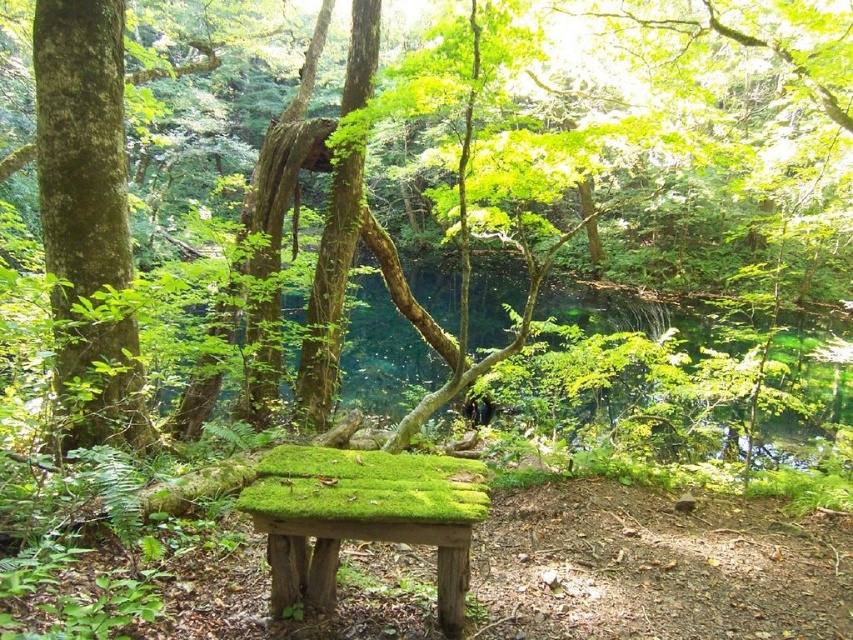
You are a hiker who wants to sit on the bench in the forest scene. There are two benches labeled as green mossy bench at center and green mossy wood bench at center. Which bench should you choose if you want to sit on the wider one?

The green mossy bench at center is wider than the green mossy wood bench at center, so you should choose the green mossy bench at center.

You are sitting on the green mossy wood bench at center and looking towards the green mossy tree at left. Which object is higher in your field of view?

Answer: The green mossy tree at left is higher in your field of view because it is positioned above the green mossy wood bench at center.